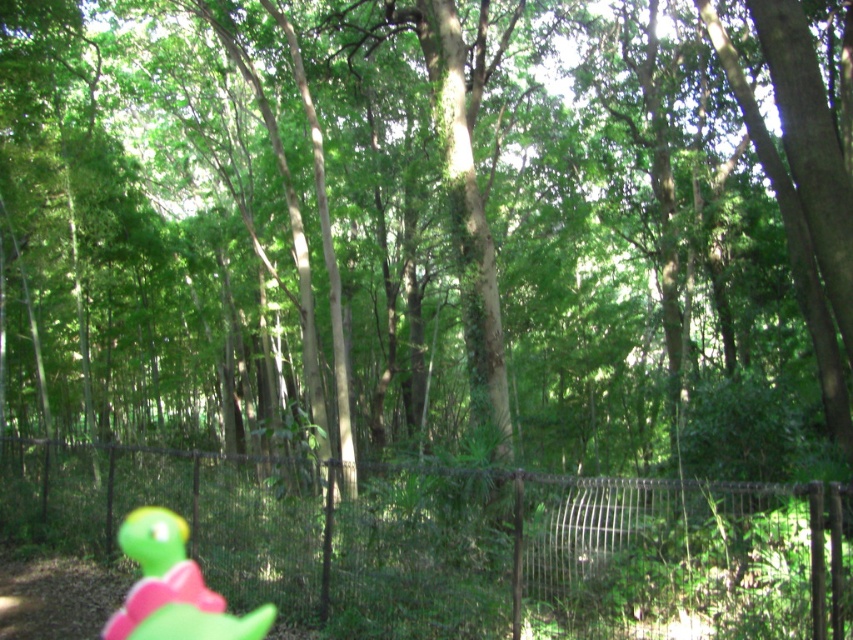
Question: Considering the relative positions of black metal fence at center and green rubber turtle at lower left in the image provided, where is black metal fence at center located with respect to green rubber turtle at lower left?

Choices:
 (A) below
 (B) above

Answer: (B)

Question: Which point is farther to the camera?

Choices:
 (A) green rubber turtle at lower left
 (B) black metal fence at center

Answer: (A)

Question: Observing the image, what is the correct spatial positioning of black metal fence at center in reference to green rubber turtle at lower left?

Choices:
 (A) below
 (B) above

Answer: (B)

Question: Where is black metal fence at center located in relation to green rubber turtle at lower left in the image?

Choices:
 (A) below
 (B) above

Answer: (B)